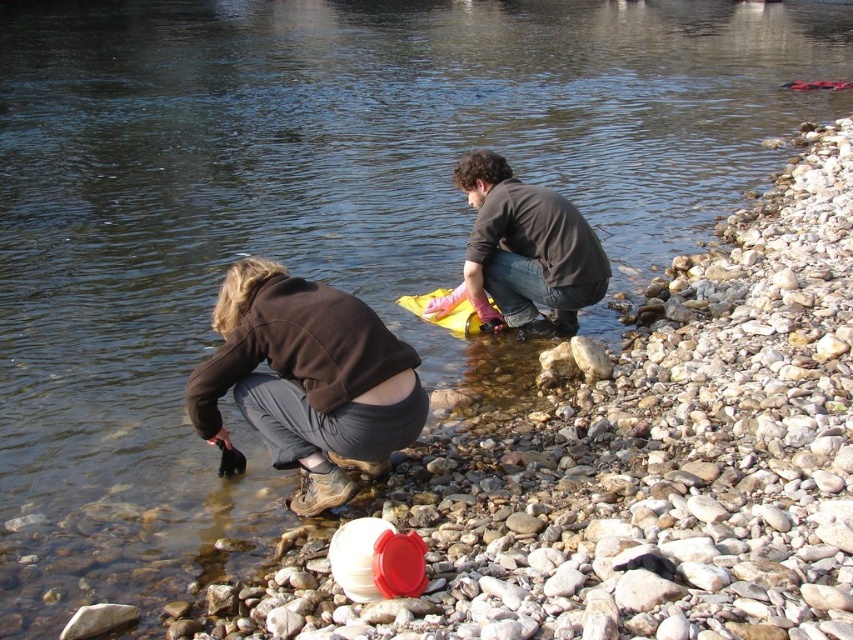
Question: Which of the following is the closest to the observer?

Choices:
 (A) coord(527,237)
 (B) coord(259,374)

Answer: (B)

Question: Is brown leather boots at lower left behind dark brown shirt at center?

Choices:
 (A) no
 (B) yes

Answer: (A)

Question: Among these objects, which one is nearest to the camera?

Choices:
 (A) dark brown shirt at center
 (B) brown leather boots at lower left

Answer: (B)

Question: Does brown leather boots at lower left lie behind dark brown shirt at center?

Choices:
 (A) no
 (B) yes

Answer: (A)

Question: Can you confirm if brown leather boots at lower left is smaller than dark brown shirt at center?

Choices:
 (A) no
 (B) yes

Answer: (B)